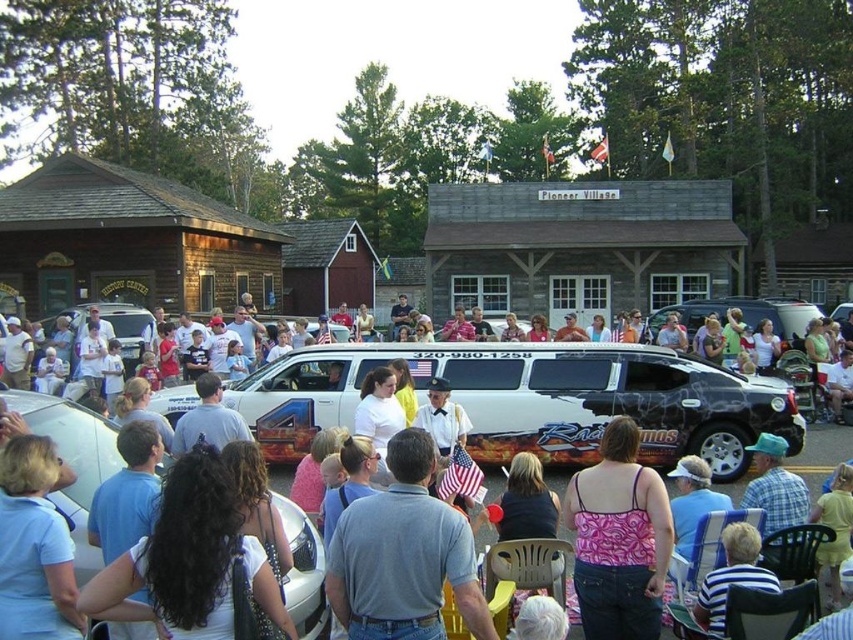
Question: Which is nearer to the white glossy car at lower left?

Choices:
 (A) white glossy van at center
 (B) pink floral tank top at center
 (C) light blue shirt at center

Answer: (C)

Question: Does white vinyl limousine at center have a larger size compared to white glossy car at lower left?

Choices:
 (A) yes
 (B) no

Answer: (B)

Question: Which point is closer to the camera?

Choices:
 (A) white glossy car at lower left
 (B) pink floral tank top at center

Answer: (A)

Question: Is the position of white vinyl limousine at center less distant than that of white glossy limousine at center?

Choices:
 (A) yes
 (B) no

Answer: (B)

Question: Does white vinyl limousine at center have a lesser width compared to light blue shirt at center?

Choices:
 (A) no
 (B) yes

Answer: (B)

Question: Which is nearer to the white vinyl limousine at center?

Choices:
 (A) pink floral tank top at center
 (B) white glossy van at center
 (C) light blue shirt at center
 (D) white glossy limousine at center

Answer: (D)